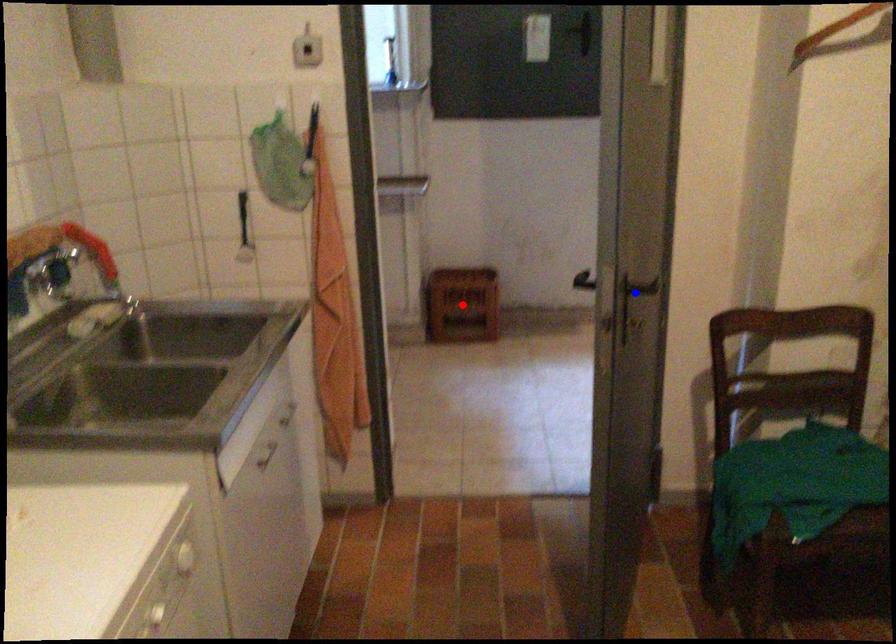
Question: Two points are marked on the image. Which point is closer to the camera?

Choices:
 (A) Blue point is closer.
 (B) Red point is closer.

Answer: (A)